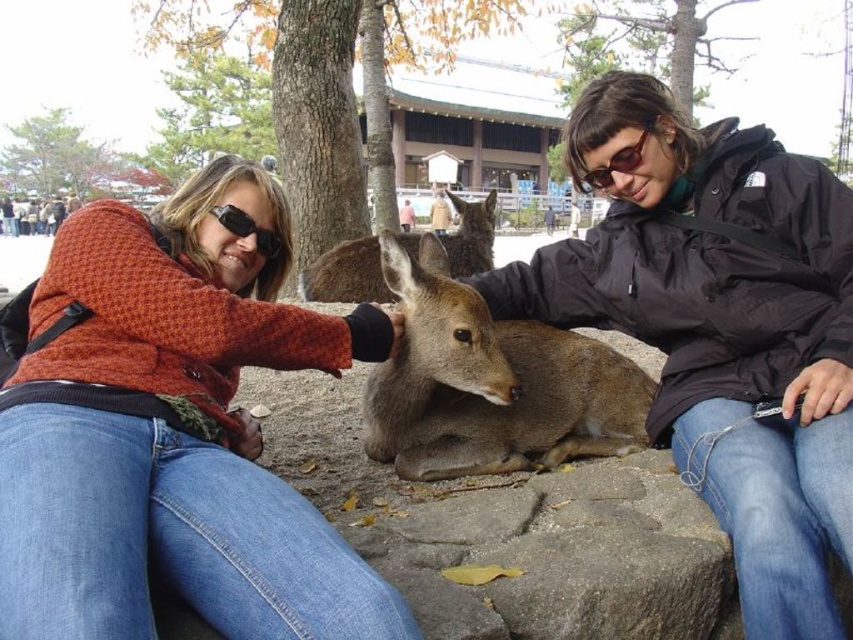
Question: Is matte black jacket at center smaller than brown fur deer at center?

Choices:
 (A) no
 (B) yes

Answer: (A)

Question: Which point is closer to the camera?

Choices:
 (A) 428,248
 (B) 192,360
 (C) 822,372

Answer: (C)

Question: Which of the following is the closest to the observer?

Choices:
 (A) (653, 330)
 (B) (608, 403)
 (C) (343, 356)
 (D) (459, 240)

Answer: (C)

Question: In this image, where is matte black jacket at center located relative to brown matte/deer at center?

Choices:
 (A) left
 (B) right

Answer: (B)

Question: Among these objects, which one is farthest from the camera?

Choices:
 (A) brown fur deer at center
 (B) black matte sunglasses at upper center
 (C) matte black jacket at center
 (D) knitted sweater at center

Answer: (A)

Question: Is knitted sweater at center to the right of matte black sunglasses at center from the viewer's perspective?

Choices:
 (A) no
 (B) yes

Answer: (A)